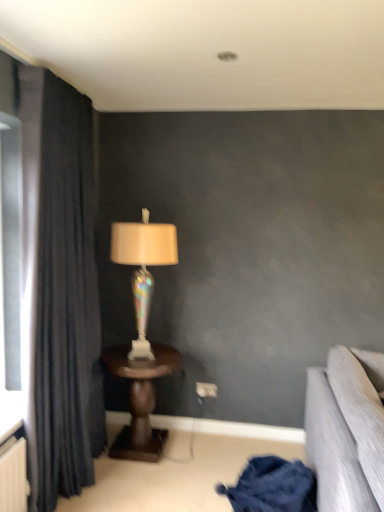
Question: From the image's perspective, is iridescent glass lamp at center above wooden table at center?

Choices:
 (A) no
 (B) yes

Answer: (B)

Question: Is iridescent glass lamp at center behind wooden table at center?

Choices:
 (A) no
 (B) yes

Answer: (B)

Question: Does iridescent glass lamp at center have a larger size compared to wooden table at center?

Choices:
 (A) no
 (B) yes

Answer: (A)

Question: From a real-world perspective, is iridescent glass lamp at center physically below wooden table at center?

Choices:
 (A) no
 (B) yes

Answer: (A)

Question: From a real-world perspective, does iridescent glass lamp at center stand above wooden table at center?

Choices:
 (A) no
 (B) yes

Answer: (B)

Question: Would you say dark fabric curtain at left is to the left or to the right of iridescent glass lamp at center in the picture?

Choices:
 (A) right
 (B) left

Answer: (B)

Question: Considering the positions of point (79, 259) and point (114, 240), is point (79, 259) closer or farther from the camera than point (114, 240)?

Choices:
 (A) farther
 (B) closer

Answer: (B)

Question: Considering their positions, is dark fabric curtain at left located in front of or behind iridescent glass lamp at center?

Choices:
 (A) front
 (B) behind

Answer: (A)

Question: From their relative heights in the image, would you say dark fabric curtain at left is taller or shorter than iridescent glass lamp at center?

Choices:
 (A) short
 (B) tall

Answer: (B)

Question: From the image's perspective, is dark fabric curtain at left located above or below dark blue fabric at lower right?

Choices:
 (A) below
 (B) above

Answer: (B)

Question: Looking at the image, does dark fabric curtain at left seem bigger or smaller compared to dark blue fabric at lower right?

Choices:
 (A) big
 (B) small

Answer: (A)

Question: Is dark fabric curtain at left in front of or behind dark blue fabric at lower right in the image?

Choices:
 (A) front
 (B) behind

Answer: (A)

Question: From a real-world perspective, is dark fabric curtain at left positioned above or below dark blue fabric at lower right?

Choices:
 (A) below
 (B) above

Answer: (B)

Question: In terms of height, does wooden table at center look taller or shorter compared to iridescent glass lamp at center?

Choices:
 (A) short
 (B) tall

Answer: (A)

Question: Considering the relative positions of wooden table at center and iridescent glass lamp at center in the image provided, is wooden table at center to the left or to the right of iridescent glass lamp at center?

Choices:
 (A) right
 (B) left

Answer: (B)